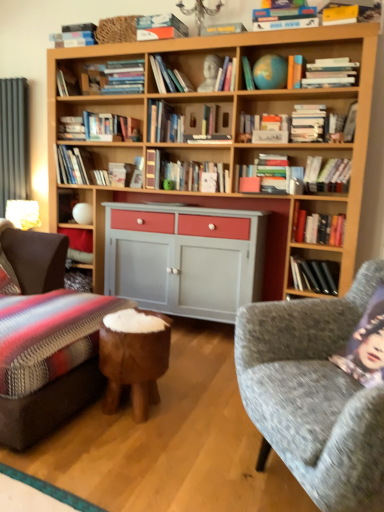
Question: Is yellow paper magazine at upper right, the fourth magazine from the bottom, a part of matte green book at center, the first magazine ordered from the bottom?

Choices:
 (A) no
 (B) yes

Answer: (A)

Question: Does matte green book at center, the first magazine ordered from the bottom, have a lesser width compared to yellow paper magazine at upper right, the fourth magazine from the bottom?

Choices:
 (A) yes
 (B) no

Answer: (A)

Question: Does matte green book at center, which is counted as the 5th magazine, starting from the top, appear on the left side of yellow paper magazine at upper right, marked as the second magazine in a top-to-bottom arrangement?

Choices:
 (A) no
 (B) yes

Answer: (B)

Question: Is matte green book at center, the first magazine ordered from the bottom, outside of yellow paper magazine at upper right, the fourth magazine from the bottom?

Choices:
 (A) yes
 (B) no

Answer: (A)

Question: From the image's perspective, is matte green book at center, the first magazine ordered from the bottom, beneath yellow paper magazine at upper right, marked as the second magazine in a top-to-bottom arrangement?

Choices:
 (A) yes
 (B) no

Answer: (A)

Question: From a real-world perspective, is textured gray fabric couch at lower right above or below green matte globe at upper center, which is the fourth book in right-to-left order?

Choices:
 (A) above
 (B) below

Answer: (B)

Question: Based on their positions, is textured gray fabric couch at lower right located to the left or right of green matte globe at upper center, which is the fourth book in right-to-left order?

Choices:
 (A) left
 (B) right

Answer: (B)

Question: Do you think textured gray fabric couch at lower right is within green matte globe at upper center, the 3th book in the left-to-right sequence, or outside of it?

Choices:
 (A) inside
 (B) outside

Answer: (B)

Question: Is textured gray fabric couch at lower right wider or thinner than green matte globe at upper center, which is the fourth book in right-to-left order?

Choices:
 (A) wide
 (B) thin

Answer: (A)

Question: In terms of height, does yellow paper magazine at upper right, the fourth magazine from the bottom, look taller or shorter compared to matte gold table lamp at left?

Choices:
 (A) tall
 (B) short

Answer: (B)

Question: Is yellow paper magazine at upper right, marked as the second magazine in a top-to-bottom arrangement, inside or outside of matte gold table lamp at left?

Choices:
 (A) inside
 (B) outside

Answer: (B)

Question: Relative to matte gold table lamp at left, is yellow paper magazine at upper right, marked as the second magazine in a top-to-bottom arrangement, in front or behind?

Choices:
 (A) behind
 (B) front

Answer: (B)

Question: Considering the relative positions of yellow paper magazine at upper right, marked as the second magazine in a top-to-bottom arrangement, and matte gold table lamp at left in the image provided, is yellow paper magazine at upper right, marked as the second magazine in a top-to-bottom arrangement, to the left or to the right of matte gold table lamp at left?

Choices:
 (A) left
 (B) right

Answer: (B)

Question: Based on their positions, is white matte magazine at center, the 2th magazine from the bottom, located to the left or right of white matte book at center, the fourth book positioned from the top?

Choices:
 (A) left
 (B) right

Answer: (A)

Question: In terms of width, does white matte magazine at center, the 2th magazine from the bottom, look wider or thinner when compared to white matte book at center, which appears as the 1th book when viewed from the right?

Choices:
 (A) thin
 (B) wide

Answer: (A)